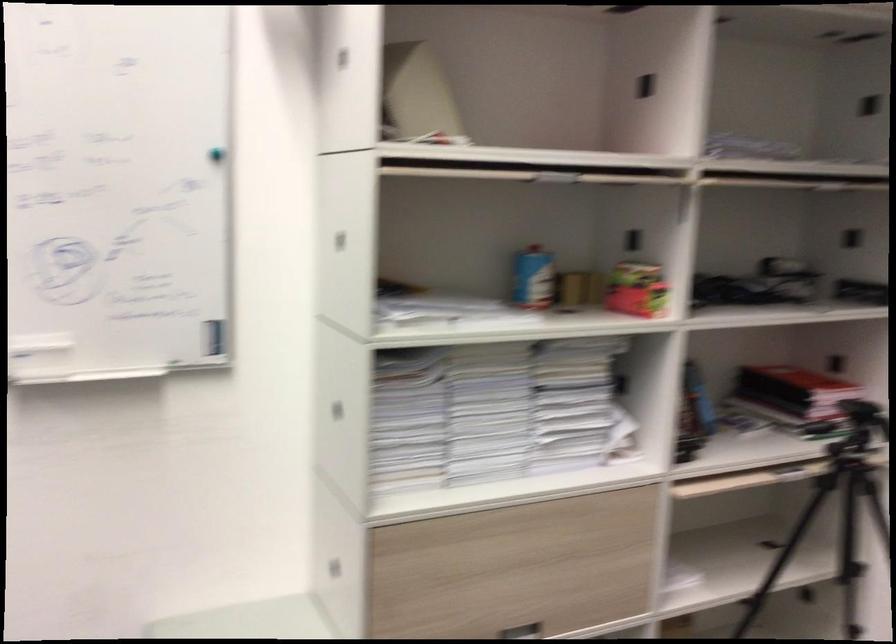
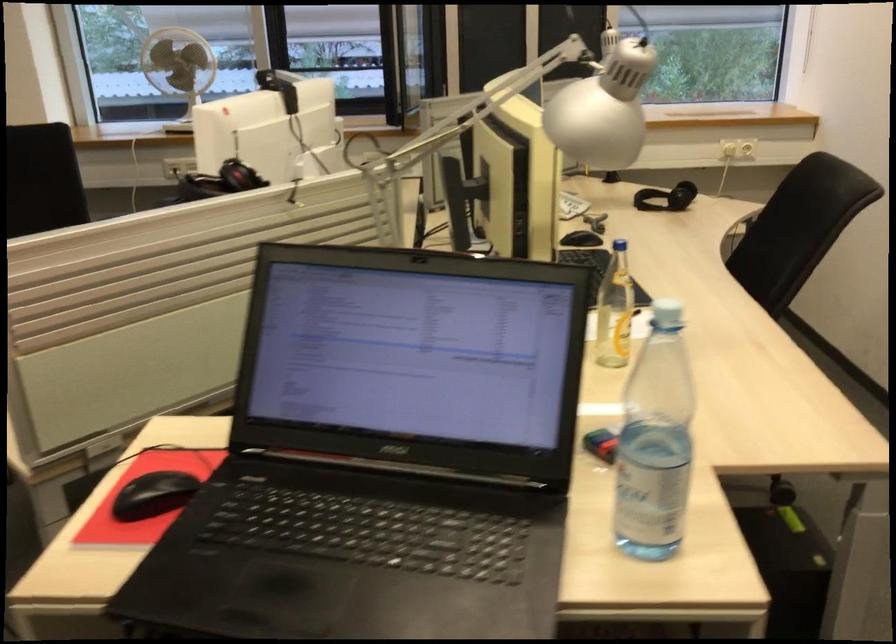
The images are taken continuously from a first-person perspective. In which direction is your viewpoint rotating?

The rotation direction of the camera is left-down.